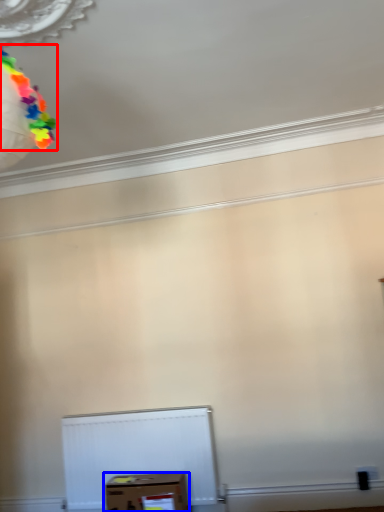
Question: Which point is closer to the camera, balloon (highlighted by a red box) or box (highlighted by a blue box)?

Choices:
 (A) balloon
 (B) box

Answer: (A)